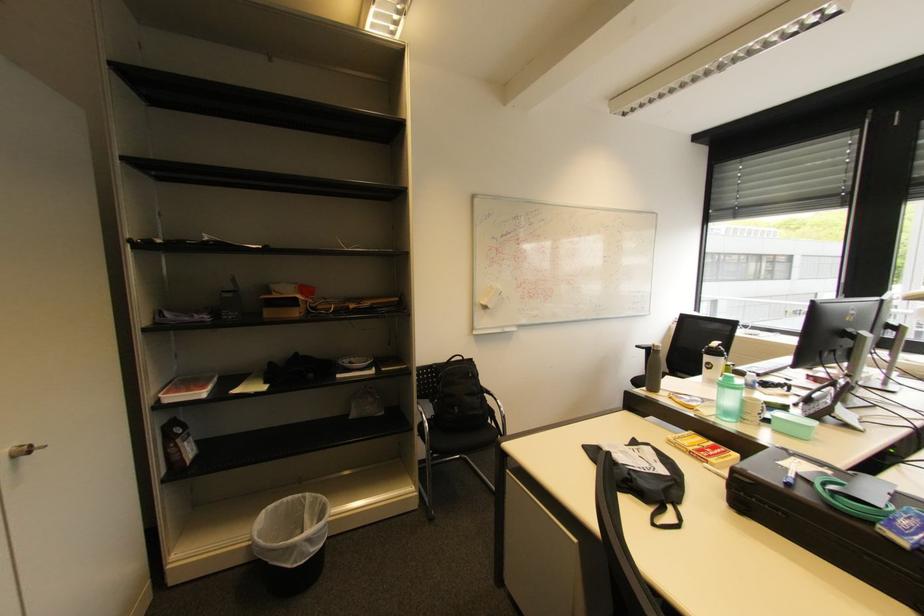
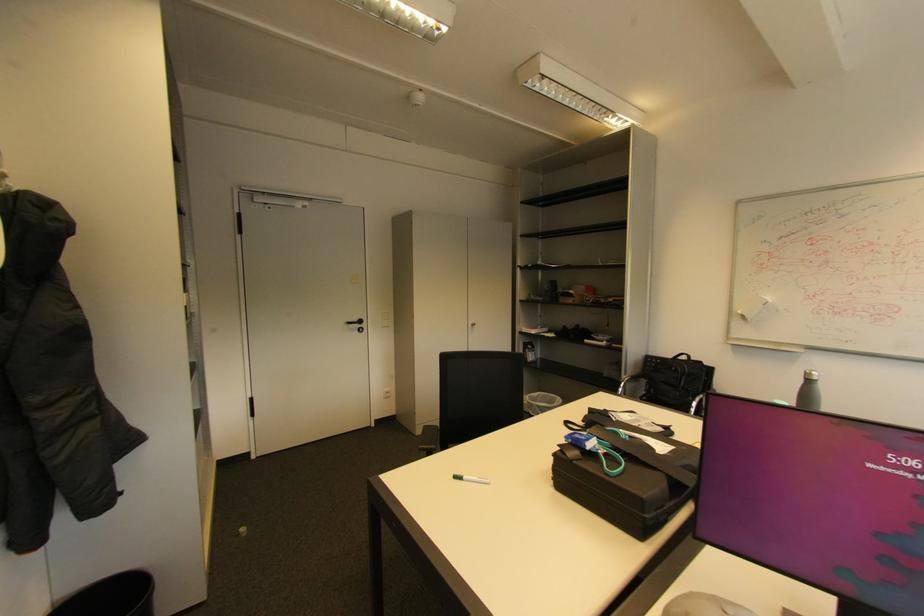
Where in the second image is the point corresponding to point 476,376 from the first image?

(678, 369)